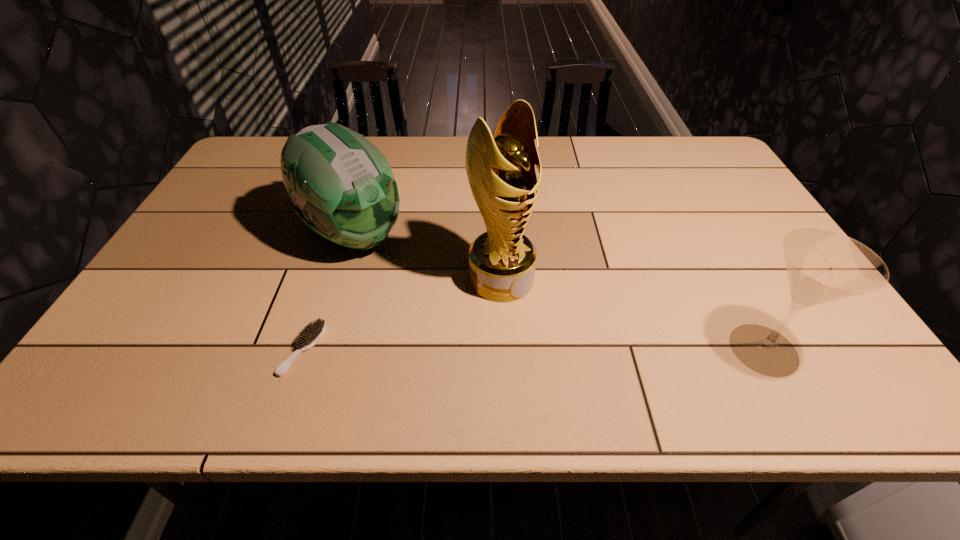
Identify the location of the shortest object. The image size is (960, 540). (311, 334).

Image resolution: width=960 pixels, height=540 pixels. In order to click on the rightmost object in this screenshot , I will do `click(822, 266)`.

I want to click on football helmet, so click(341, 185).

This screenshot has height=540, width=960. In order to click on award in this screenshot , I will do `click(501, 171)`.

The width and height of the screenshot is (960, 540). I want to click on the tallest object, so click(501, 171).

Identify the location of vacant position located on the right of the scrubbing brush. coord(397,349).

This screenshot has height=540, width=960. What are the coordinates of `free location located 0.180m on the left of the flute glass` in the screenshot? It's located at (640, 349).

Locate an element on the screen. vacant area situated 0.250m on the visor of the football helmet is located at coordinates (453, 314).

Locate an element on the screen. The width and height of the screenshot is (960, 540). free space located on the visor of the football helmet is located at coordinates (466, 325).

Where is `vacant space located on the visor of the football helmet`? This screenshot has height=540, width=960. vacant space located on the visor of the football helmet is located at coordinates (398, 270).